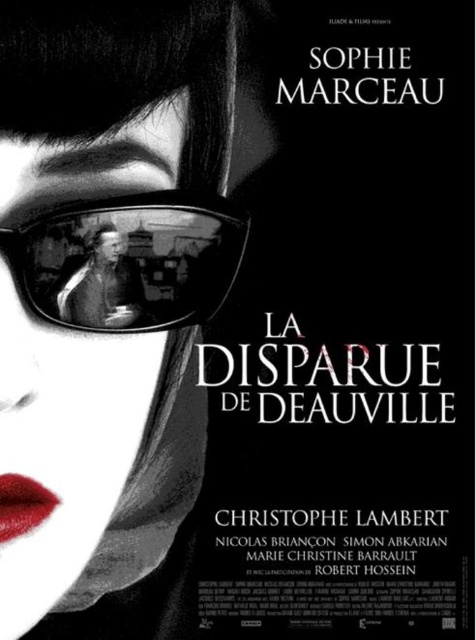
Is shiny reflective glasses at center positioned at the back of shiny red lipstick at lower left?

That is False.

Is shiny reflective glasses at center above shiny red lipstick at lower left?

Yes, shiny reflective glasses at center is above shiny red lipstick at lower left.

This screenshot has width=476, height=640. What are the coordinates of `shiny reflective glasses at center` in the screenshot? It's located at (128, 260).

Is shiny reflective glasses at center taller than smooth plastic glasses at center?

Indeed, shiny reflective glasses at center has a greater height compared to smooth plastic glasses at center.

Between shiny reflective glasses at center and smooth plastic glasses at center, which one appears on the right side from the viewer's perspective?

Positioned to the right is shiny reflective glasses at center.

Does point (180, 196) come closer to viewer compared to point (90, 268)?

No, (180, 196) is further to viewer.

Locate an element on the screen. shiny reflective glasses at center is located at coordinates (128, 260).

How distant is smooth plastic glasses at center from shiny red lipstick at lower left?

smooth plastic glasses at center and shiny red lipstick at lower left are 4.46 inches apart.

Is smooth plastic glasses at center positioned before shiny red lipstick at lower left?

Yes, smooth plastic glasses at center is in front of shiny red lipstick at lower left.

Is point (89, 237) more distant than point (7, 524)?

That is False.

Find the location of `smooth plastic glasses at center`. smooth plastic glasses at center is located at coordinates (100, 282).